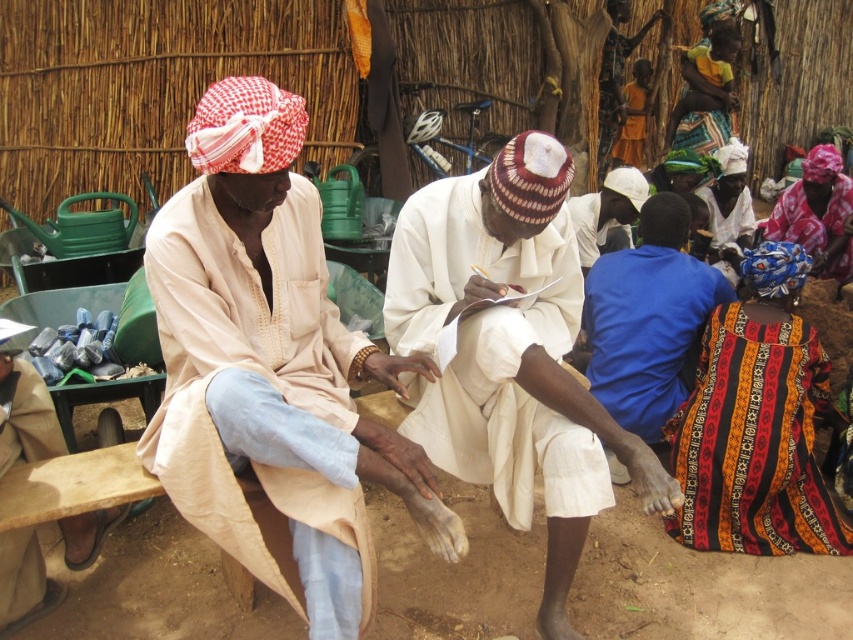
Question: Among these objects, which one is nearest to the camera?

Choices:
 (A) white cotton hat at center
 (B) multicolored woven cloth at lower right
 (C) yellow-green woven cloth at upper right
 (D) brown fabric bag at lower left

Answer: (A)

Question: Is the position of yellow-green woven cloth at upper right more distant than that of orange fabric dress at upper center?

Choices:
 (A) yes
 (B) no

Answer: (B)

Question: Which point appears closest to the camera in this image?

Choices:
 (A) (630, 104)
 (B) (691, 524)

Answer: (B)

Question: Is brown fabric bag at lower left further to camera compared to orange fabric dress at upper center?

Choices:
 (A) yes
 (B) no

Answer: (B)

Question: Estimate the real-world distances between objects in this image. Which object is closer to the patterned fabric headscarf at upper right?

Choices:
 (A) brown leather shoe at lower left
 (B) blue cotton shirt at lower right
 (C) white cloth at center
 (D) multicolored woven cloth at lower right

Answer: (C)

Question: Does white cotton hat at center appear under white cloth at center?

Choices:
 (A) yes
 (B) no

Answer: (A)